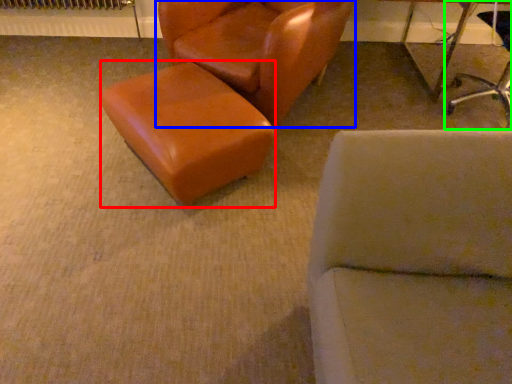
Question: Which object is positioned closest to stool (highlighted by a red box)? Select from chair (highlighted by a blue box) and chair (highlighted by a green box).

Choices:
 (A) chair
 (B) chair

Answer: (A)